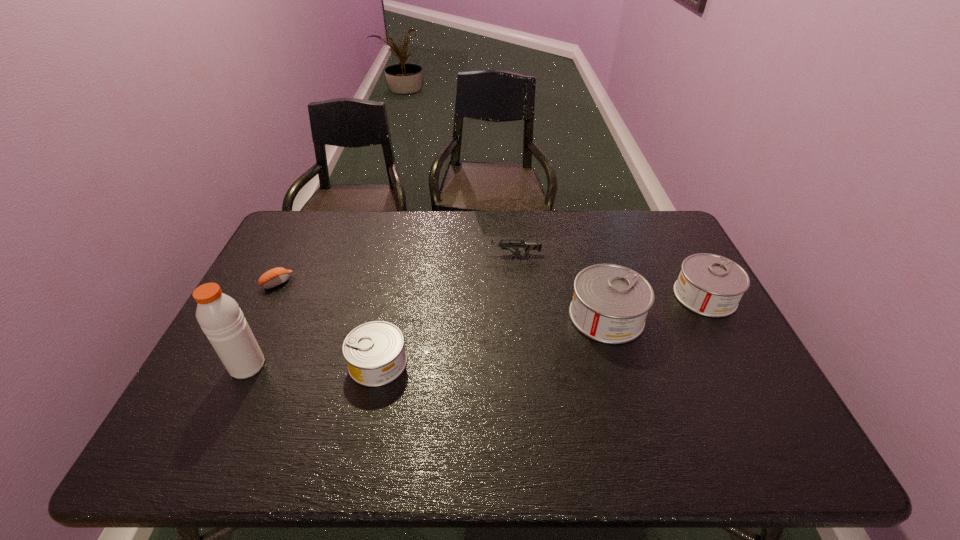
At what (x,y) coordinates should I click in order to perform the action: click on free space located 0.400m on the back of the fifth object from left to right. Please return your answer as a coordinate pair (x, y). Image resolution: width=960 pixels, height=540 pixels. Looking at the image, I should click on (577, 214).

At what (x,y) coordinates should I click in order to perform the action: click on free space located on the front of the rightmost can. Please return your answer as a coordinate pair (x, y). This screenshot has width=960, height=540. Looking at the image, I should click on (729, 340).

The height and width of the screenshot is (540, 960). What are the coordinates of `vacant point located aimed along the barrel of the fifth tallest object` in the screenshot? It's located at (362, 254).

The image size is (960, 540). Find the location of `free region located 0.140m aimed along the barrel of the fifth tallest object`. free region located 0.140m aimed along the barrel of the fifth tallest object is located at coordinates (441, 254).

Locate an element on the screen. free space located aimed along the barrel of the fifth tallest object is located at coordinates point(365,254).

Find the location of a particular element. vacant space situated 0.070m on the right of the shortest object is located at coordinates (314, 282).

You are a GUI agent. You are given a task and a screenshot of the screen. Output one action in this format:
    pyautogui.click(x=<x>, y=<y>)
    Task: Click on the vacant point located on the right of the tallest object
    This screenshot has width=960, height=540.
    Given the screenshot: What is the action you would take?
    pyautogui.click(x=336, y=366)

Locate an element on the screen. The image size is (960, 540). object at the near edge is located at coordinates (374, 351).

This screenshot has width=960, height=540. I want to click on sushi that is at the left edge, so click(x=276, y=276).

This screenshot has height=540, width=960. I want to click on shaker that is positioned at the left edge, so click(219, 316).